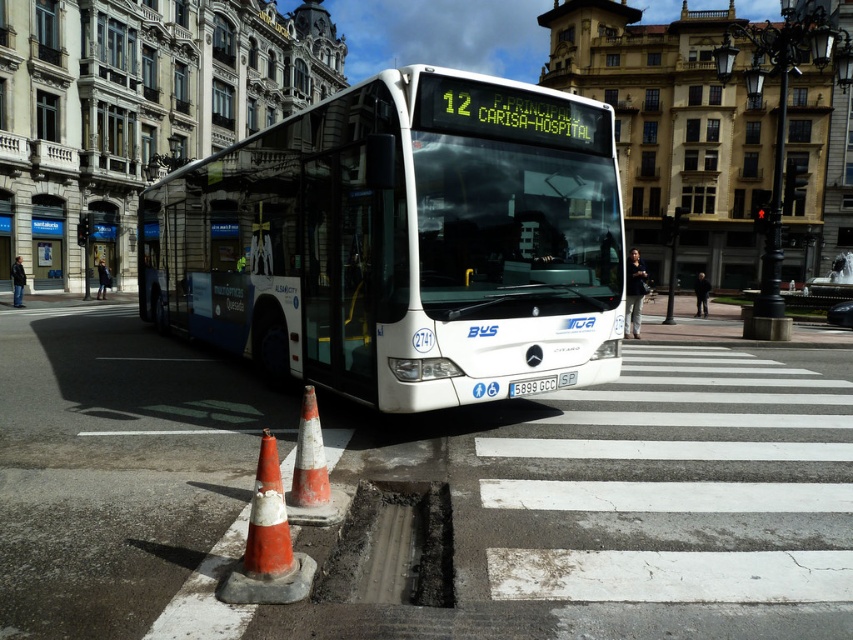
Question: Considering the relative positions of orange/white plastic traffic cone at lower center and orange/white striped cone at lower center in the image provided, where is orange/white plastic traffic cone at lower center located with respect to orange/white striped cone at lower center?

Choices:
 (A) left
 (B) right

Answer: (B)

Question: Which point appears farthest from the camera in this image?

Choices:
 (A) (102, 272)
 (B) (270, 452)

Answer: (A)

Question: Is white glossy bus at center further to the viewer compared to orange/white striped cone at lower center?

Choices:
 (A) no
 (B) yes

Answer: (B)

Question: Which object appears closest to the camera in this image?

Choices:
 (A) metallic glass bus stop at left
 (B) orange/white striped cone at lower center
 (C) white glossy bus at center
 (D) orange/white plastic traffic cone at lower center

Answer: (D)

Question: Which of the following is the farthest from the observer?

Choices:
 (A) (468, 401)
 (B) (302, 442)
 (C) (103, 291)

Answer: (C)

Question: Is white glossy bus at center below orange/white plastic traffic cone at lower center?

Choices:
 (A) no
 (B) yes

Answer: (A)